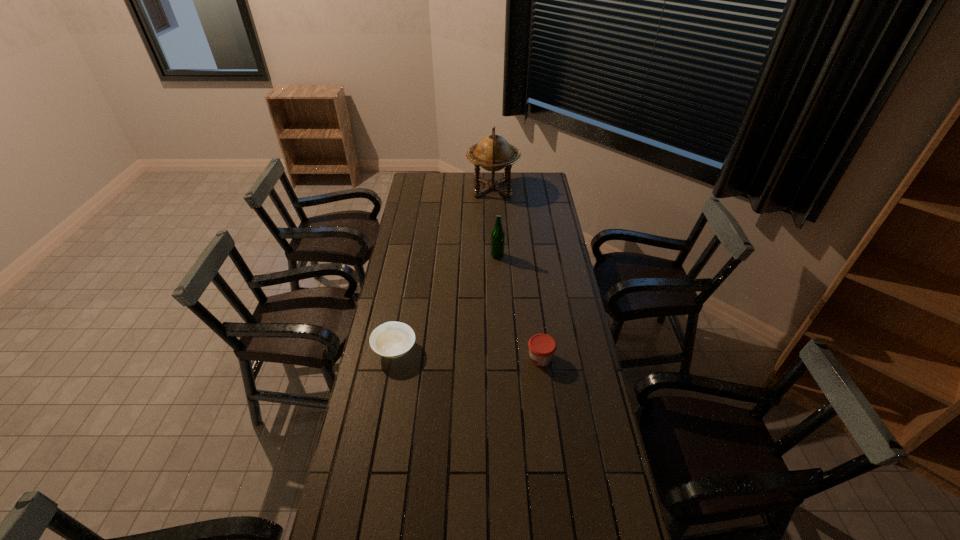
The height and width of the screenshot is (540, 960). In order to click on empty space that is in between the second shortest object and the beer bottle in this screenshot , I will do `click(519, 307)`.

At what (x,y) coordinates should I click in order to perform the action: click on object that stands as the closest to the second farthest object. Please return your answer as a coordinate pair (x, y). This screenshot has width=960, height=540. Looking at the image, I should click on (493, 153).

Locate an element on the screen. The width and height of the screenshot is (960, 540). object that is the closest to the tallest object is located at coordinates (498, 235).

The image size is (960, 540). Identify the location of vacant space that satisfies the following two spatial constraints: 1. on the front-facing side of the globe; 2. on the front side of the leftmost object. (499, 349).